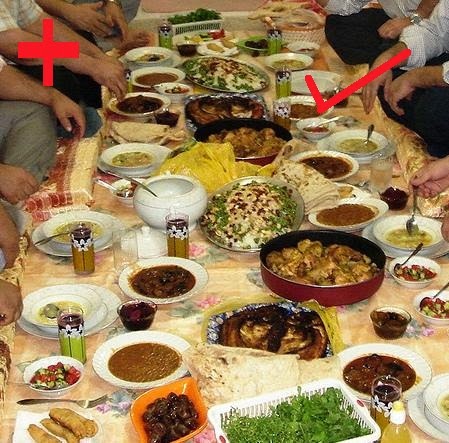
Locate an element on the screen. Image resolution: width=449 pixels, height=443 pixels. beverage glass is located at coordinates (75, 341), (80, 256), (131, 250), (180, 244), (168, 36), (273, 42), (285, 84), (281, 111), (382, 170), (385, 414).